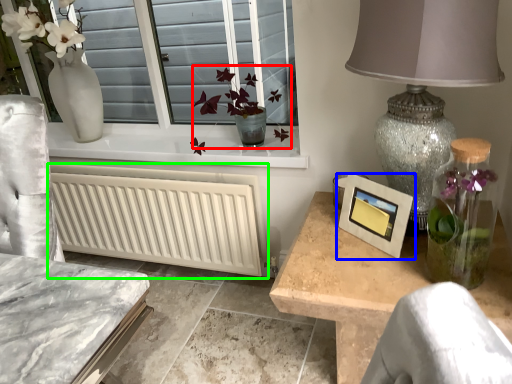
Question: Which is farther away from floral arrangement (highlighted by a red box)? picture frame (highlighted by a blue box) or radiator (highlighted by a green box)?

Choices:
 (A) picture frame
 (B) radiator

Answer: (A)